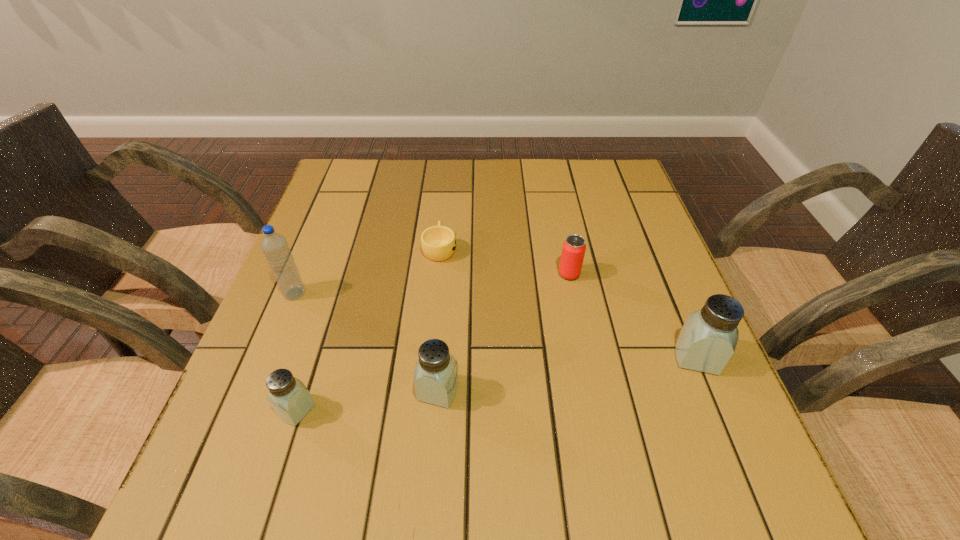
This screenshot has height=540, width=960. What are the coordinates of `spot to insert another saltshaker for uniform distribution` in the screenshot? It's located at (571, 374).